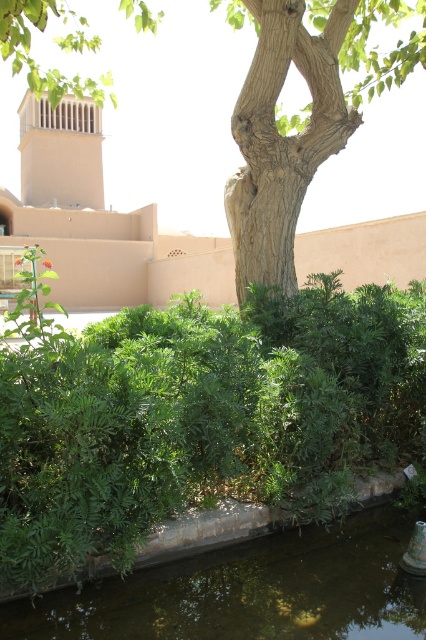
You are standing in the garden and see the green leafy hedge at center and the smooth brown tree trunk at center. Which object is positioned to the left when viewed from your perspective?

The green leafy hedge at center is positioned to the left of the smooth brown tree trunk at center.

You are standing in the serene outdoor scene and want to place a small decorative stone between the two points, point (397, 444) and point (368, 608). Which point is closer to you so that you can place the stone in front of it?

Point (368, 608) is closer to you, so placing the stone in front of it would be closer to your position.